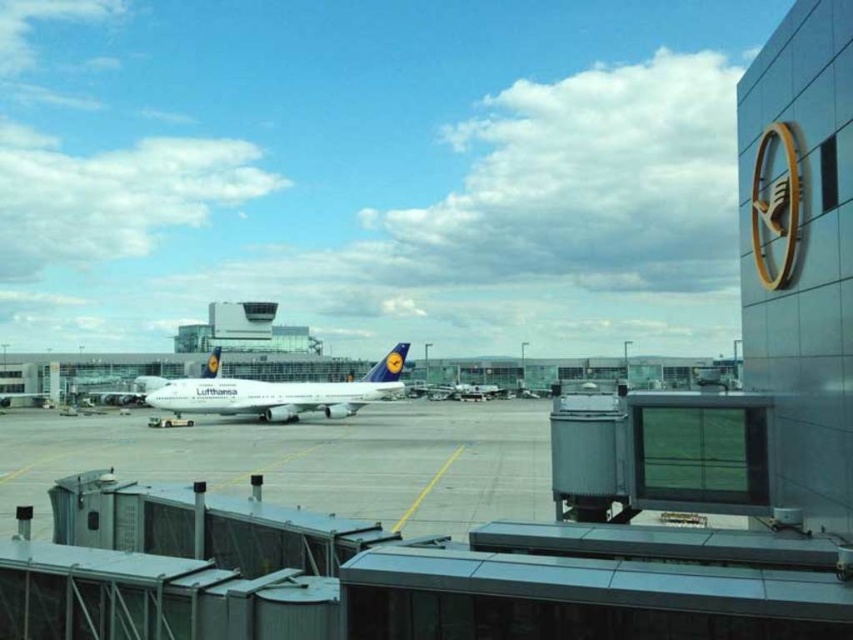
Can you confirm if smooth concrete tarmac at center is bigger than metallic silver airplane at center?

Yes.

Image resolution: width=853 pixels, height=640 pixels. Describe the element at coordinates (306, 460) in the screenshot. I see `smooth concrete tarmac at center` at that location.

Describe the element at coordinates (306, 460) in the screenshot. This screenshot has height=640, width=853. I see `smooth concrete tarmac at center` at that location.

This screenshot has height=640, width=853. I want to click on smooth concrete tarmac at center, so click(x=306, y=460).

Who is positioned more to the left, white glossy airplane at center or metallic silver airplane at center?

white glossy airplane at center is more to the left.

What do you see at coordinates (274, 392) in the screenshot? I see `white glossy airplane at center` at bounding box center [274, 392].

Is point (202, 403) farther from camera compared to point (454, 385)?

No, (202, 403) is in front of (454, 385).

You are a GUI agent. You are given a task and a screenshot of the screen. Output one action in this format:
    pyautogui.click(x=<x>, y=<y>)
    Task: Click on the white glossy airplane at center
    The width and height of the screenshot is (853, 640).
    Given the screenshot: What is the action you would take?
    pyautogui.click(x=274, y=392)

Is smooth concrete tarmac at center taller than white glossy airplane at center?

Yes.

At what (x,y) coordinates should I click in order to perform the action: click on smooth concrete tarmac at center. Please return your answer as a coordinate pair (x, y). Looking at the image, I should click on (306, 460).

Does point (248, 458) lie in front of point (378, 365)?

Yes, it is in front of point (378, 365).

You are a GUI agent. You are given a task and a screenshot of the screen. Output one action in this format:
    pyautogui.click(x=<x>, y=<y>)
    Task: Click on the smooth concrete tarmac at center
    
    Given the screenshot: What is the action you would take?
    pyautogui.click(x=306, y=460)